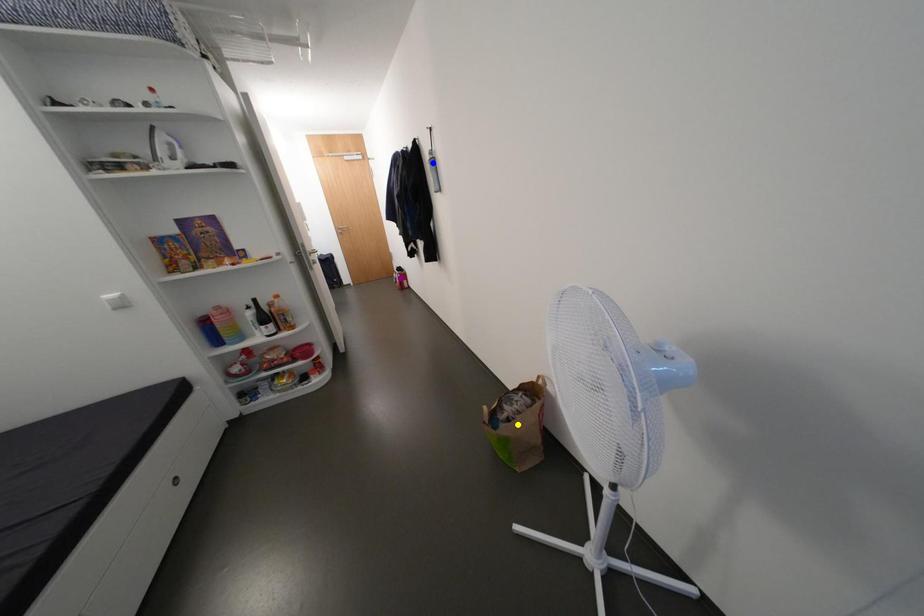
Order these from nearest to farthest:
yellow point
blue point
purple point

yellow point < blue point < purple point